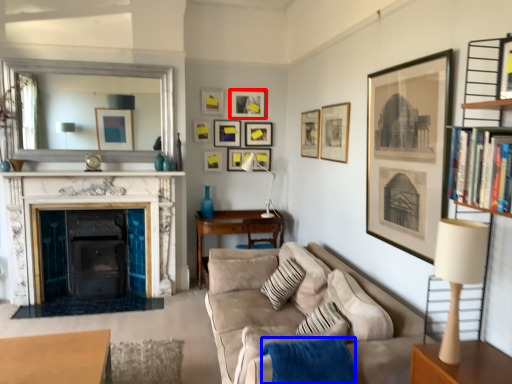
Question: Which of the following is the closest to the observer, picture frame (highlighted by a red box) or blanket (highlighted by a blue box)?

Choices:
 (A) picture frame
 (B) blanket

Answer: (B)